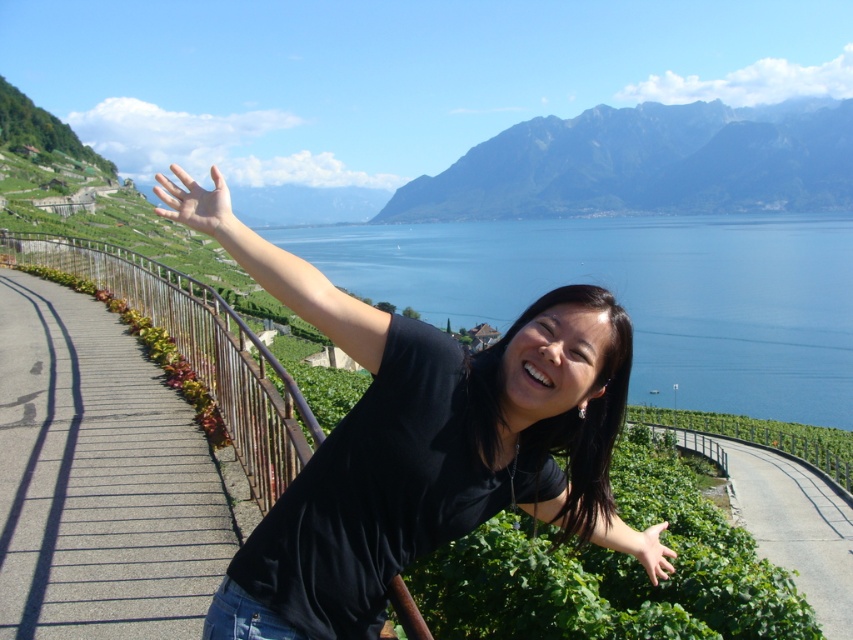
Based on the photo, you are standing at the point marked by the coordinates (639, 294) in the image. What is the name of the object located exactly at your current position?

The blue water at center is represented by point (639, 294), so the object at your current position is the blue water at center.

Looking at this image, you are a photographer trying to capture the perfect shot of the green leafy hedge at lower center and the black matte arm at lower center. To ensure both are in frame, you need to know which object is wider. Can you determine which one is wider?

The green leafy hedge at lower center might be wider than black matte arm at lower center, so the hedge is likely wider than the arm.